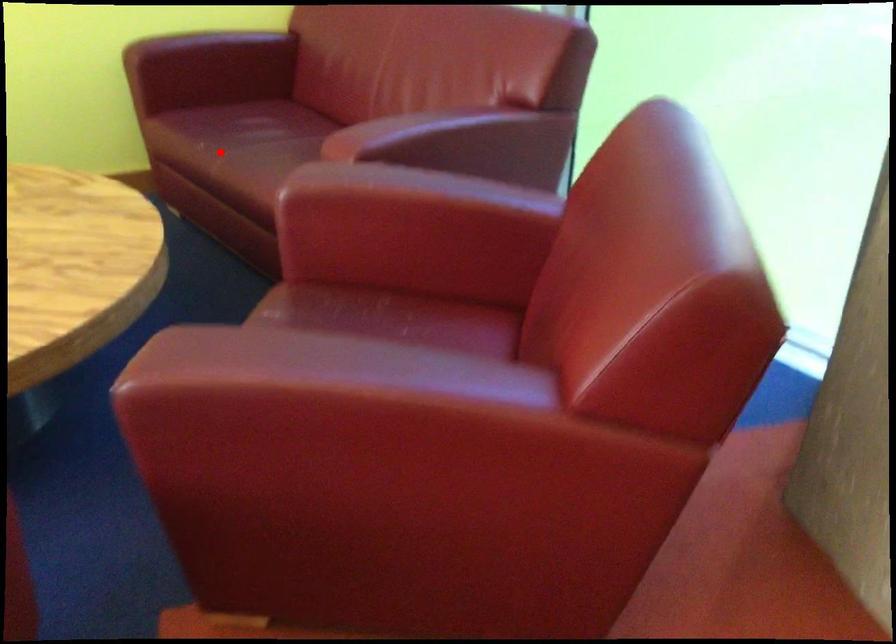
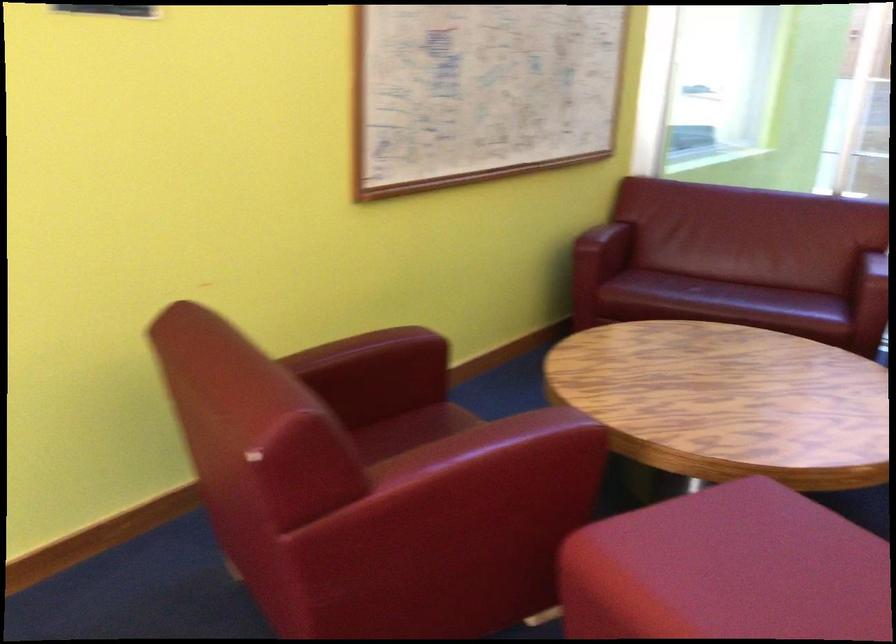
Question: I am providing you with two images of the same scene from different viewpoints. Given a red point in image1, look at the same physical point in image2. Is it:

Choices:
 (A) Closer to the viewpoint
 (B) Farther from the viewpoint

Answer: (B)